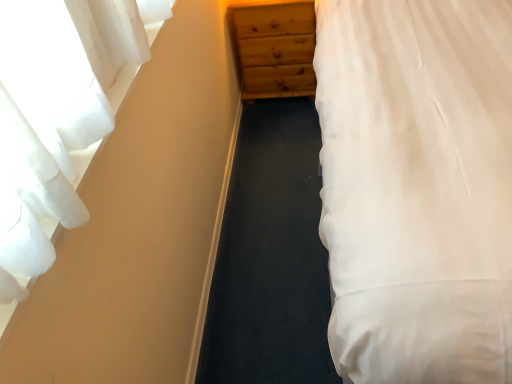
Question: Does wooden chest of drawers at center have a larger size compared to white cotton bed at right?

Choices:
 (A) no
 (B) yes

Answer: (A)

Question: Can you confirm if wooden chest of drawers at center is positioned to the right of white cotton bed at right?

Choices:
 (A) no
 (B) yes

Answer: (A)

Question: Considering the relative sizes of wooden chest of drawers at center and white cotton bed at right in the image provided, is wooden chest of drawers at center smaller than white cotton bed at right?

Choices:
 (A) no
 (B) yes

Answer: (B)

Question: Is wooden chest of drawers at center to the left of white cotton bed at right from the viewer's perspective?

Choices:
 (A) no
 (B) yes

Answer: (B)

Question: Considering the relative sizes of wooden chest of drawers at center and white cotton bed at right in the image provided, is wooden chest of drawers at center shorter than white cotton bed at right?

Choices:
 (A) no
 (B) yes

Answer: (B)

Question: Looking at their shapes, would you say white sheer curtain at left is wider or thinner than white cotton bed at right?

Choices:
 (A) wide
 (B) thin

Answer: (B)

Question: From the image's perspective, is white sheer curtain at left above or below white cotton bed at right?

Choices:
 (A) below
 (B) above

Answer: (A)

Question: In terms of height, does white sheer curtain at left look taller or shorter compared to white cotton bed at right?

Choices:
 (A) short
 (B) tall

Answer: (A)

Question: From a real-world perspective, is white sheer curtain at left positioned above or below white cotton bed at right?

Choices:
 (A) above
 (B) below

Answer: (A)

Question: Considering the positions of point click(x=307, y=66) and point click(x=415, y=271), is point click(x=307, y=66) closer or farther from the camera than point click(x=415, y=271)?

Choices:
 (A) farther
 (B) closer

Answer: (A)

Question: From a real-world perspective, is wooden chest of drawers at center positioned above or below white cotton bed at right?

Choices:
 (A) below
 (B) above

Answer: (A)

Question: Considering the positions of wooden chest of drawers at center and white cotton bed at right in the image, is wooden chest of drawers at center bigger or smaller than white cotton bed at right?

Choices:
 (A) big
 (B) small

Answer: (B)

Question: In terms of height, does wooden chest of drawers at center look taller or shorter compared to white cotton bed at right?

Choices:
 (A) tall
 (B) short

Answer: (B)

Question: Is white sheer curtain at left wider or thinner than wooden chest of drawers at center?

Choices:
 (A) thin
 (B) wide

Answer: (A)

Question: From a real-world perspective, is white sheer curtain at left positioned above or below wooden chest of drawers at center?

Choices:
 (A) above
 (B) below

Answer: (A)